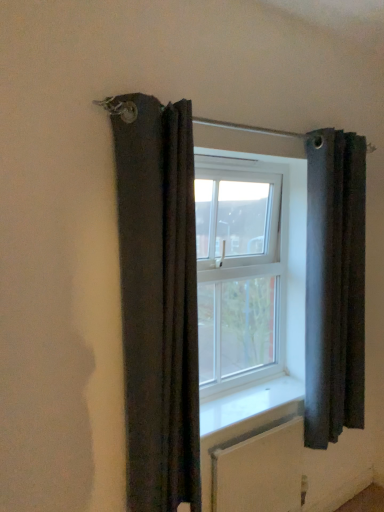
Question: Is dark gray fabric curtain at right, the 2th curtain in the left-to-right sequence, facing towards white textured radiator at lower center?

Choices:
 (A) yes
 (B) no

Answer: (B)

Question: From a real-world perspective, is dark gray fabric curtain at right, the 1th curtain when ordered from back to front, physically below white textured radiator at lower center?

Choices:
 (A) yes
 (B) no

Answer: (B)

Question: Considering the relative sizes of dark gray fabric curtain at right, the 2th curtain in the left-to-right sequence, and white textured radiator at lower center in the image provided, is dark gray fabric curtain at right, the 2th curtain in the left-to-right sequence, thinner than white textured radiator at lower center?

Choices:
 (A) yes
 (B) no

Answer: (B)

Question: Does dark gray fabric curtain at right, acting as the 1th curtain starting from the right, have a lesser height compared to white textured radiator at lower center?

Choices:
 (A) no
 (B) yes

Answer: (A)

Question: Is dark gray fabric curtain at right, which is the second curtain in front-to-back order, not within white textured radiator at lower center?

Choices:
 (A) no
 (B) yes

Answer: (B)

Question: From a real-world perspective, relative to white textured radiator at lower center, is clear glass window at center vertically above or below?

Choices:
 (A) below
 (B) above

Answer: (B)

Question: In the image, is clear glass window at center positioned in front of or behind white textured radiator at lower center?

Choices:
 (A) behind
 (B) front

Answer: (A)

Question: Looking at their shapes, would you say clear glass window at center is wider or thinner than white textured radiator at lower center?

Choices:
 (A) thin
 (B) wide

Answer: (B)

Question: Is clear glass window at center inside or outside of white textured radiator at lower center?

Choices:
 (A) outside
 (B) inside

Answer: (A)

Question: Considering the positions of point (162, 162) and point (228, 415), is point (162, 162) closer or farther from the camera than point (228, 415)?

Choices:
 (A) closer
 (B) farther

Answer: (A)

Question: In terms of size, does dark fabric curtain at left, which is the 1th curtain in left-to-right order, appear bigger or smaller than clear glass window at center?

Choices:
 (A) small
 (B) big

Answer: (B)

Question: Based on their positions, is dark fabric curtain at left, which is the 1th curtain in left-to-right order, located to the left or right of clear glass window at center?

Choices:
 (A) left
 (B) right

Answer: (A)

Question: From a real-world perspective, is dark fabric curtain at left, acting as the first curtain starting from the front, physically located above or below clear glass window at center?

Choices:
 (A) below
 (B) above

Answer: (A)

Question: Does point (288, 465) appear closer or farther from the camera than point (150, 393)?

Choices:
 (A) closer
 (B) farther

Answer: (B)

Question: Do you think white textured radiator at lower center is within dark fabric curtain at left, placed as the 2th curtain when sorted from right to left, or outside of it?

Choices:
 (A) outside
 (B) inside

Answer: (A)